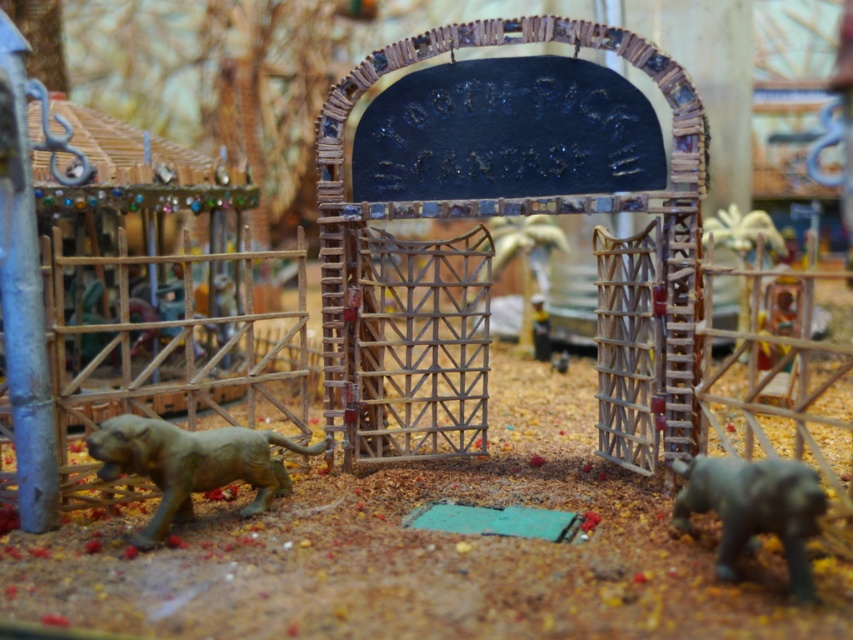
Question: Is gold metallic tiger at lower left below gray matte baby elephant at lower right?

Choices:
 (A) yes
 (B) no

Answer: (B)

Question: Which object appears farthest from the camera in this image?

Choices:
 (A) gold metallic tiger at lower left
 (B) wooden gate at center
 (C) gray matte baby elephant at lower right

Answer: (B)

Question: Estimate the real-world distances between objects in this image. Which object is farther from the gray matte baby elephant at lower right?

Choices:
 (A) wooden gate at center
 (B) gold metallic tiger at lower left

Answer: (B)

Question: Is wooden gate at center wider than gold metallic tiger at lower left?

Choices:
 (A) yes
 (B) no

Answer: (A)

Question: Can you confirm if wooden gate at center is thinner than gold metallic tiger at lower left?

Choices:
 (A) no
 (B) yes

Answer: (A)

Question: Which object is positioned farthest from the gold metallic tiger at lower left?

Choices:
 (A) wooden gate at center
 (B) gray matte baby elephant at lower right

Answer: (B)